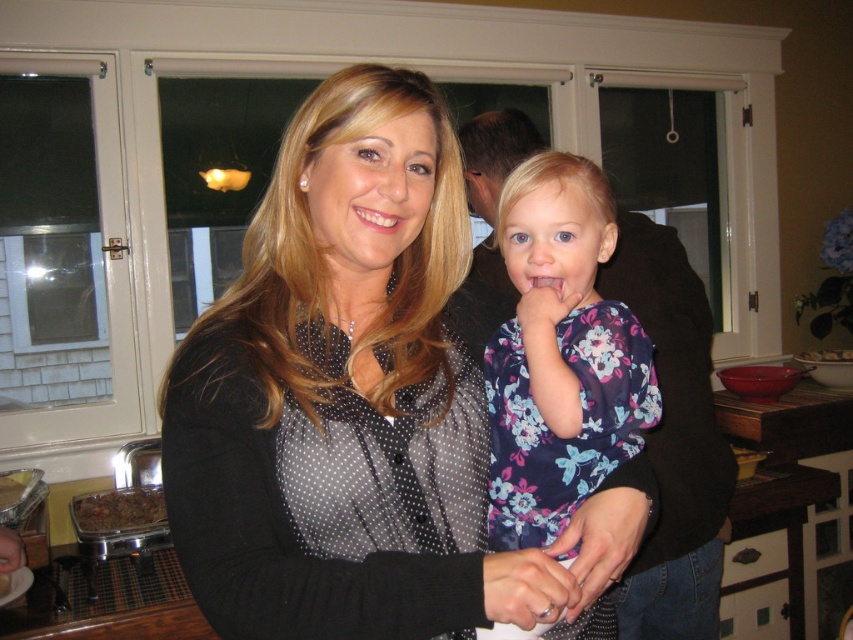
Consider the image. Is black dotted shirt at center wider than floral fabric shirt at center?

Yes, black dotted shirt at center is wider than floral fabric shirt at center.

Is black dotted shirt at center below floral fabric shirt at center?

No, black dotted shirt at center is not below floral fabric shirt at center.

Identify the location of black dotted shirt at center. (337, 392).

This screenshot has height=640, width=853. In order to click on black dotted shirt at center in this screenshot , I will do tap(337, 392).

Does point (567, 381) come closer to viewer compared to point (807, 362)?

Yes.

Is floral fabric shirt at center positioned behind white glossy bowl at upper right?

No, it is not.

Does point (624, 374) lie in front of point (799, 358)?

Yes, point (624, 374) is closer to viewer.

In order to click on floral fabric shirt at center in this screenshot , I will do `click(560, 355)`.

Which is behind, point (363, 124) or point (164, 506)?

The point (164, 506) is more distant.

Between black dotted shirt at center and brown crumbly food at lower left, which one is positioned higher?

black dotted shirt at center

Describe the element at coordinates (337, 392) in the screenshot. Image resolution: width=853 pixels, height=640 pixels. I see `black dotted shirt at center` at that location.

The height and width of the screenshot is (640, 853). In order to click on black dotted shirt at center in this screenshot , I will do `click(337, 392)`.